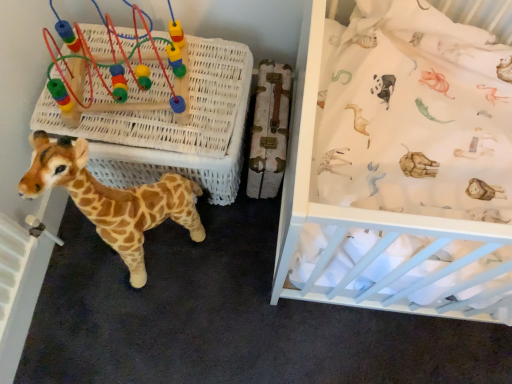
The width and height of the screenshot is (512, 384). I want to click on vacant space in front of white wicker basket at center, so click(159, 296).